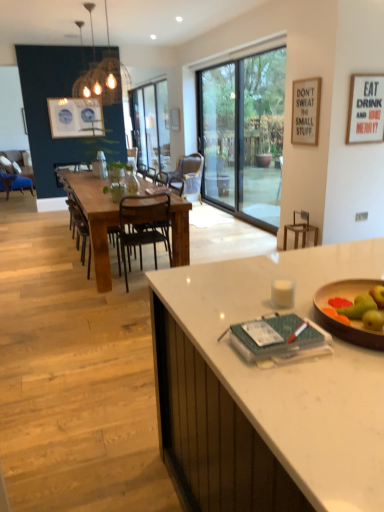
Question: Is brown wooden bar stool at center inside or outside of green matte apple at right?

Choices:
 (A) inside
 (B) outside

Answer: (B)

Question: Looking at the image, does brown wooden bar stool at center seem bigger or smaller compared to green matte apple at right?

Choices:
 (A) small
 (B) big

Answer: (B)

Question: Which of these objects is positioned closest to the clear glass bottle at center?

Choices:
 (A) transparent glass window at center
 (B) blue ceramic plates at upper left
 (C) matte blue chair at left, the 5th chair viewed from the right
 (D) white matte picture frame at upper right, the second picture frame positioned from the left
 (E) matte white picture frame at center, the third picture frame positioned from the front

Answer: (B)

Question: Considering the real-world distances, which object is farthest from the white matte picture frame at upper right, which is the 1th picture frame from bottom to top?

Choices:
 (A) transparent glass window at center
 (B) brown wooden bar stool at center
 (C) rustic wood table at center
 (D) matte blue chair at left, the fifth chair when ordered from front to back
 (E) green matte apple at right

Answer: (D)